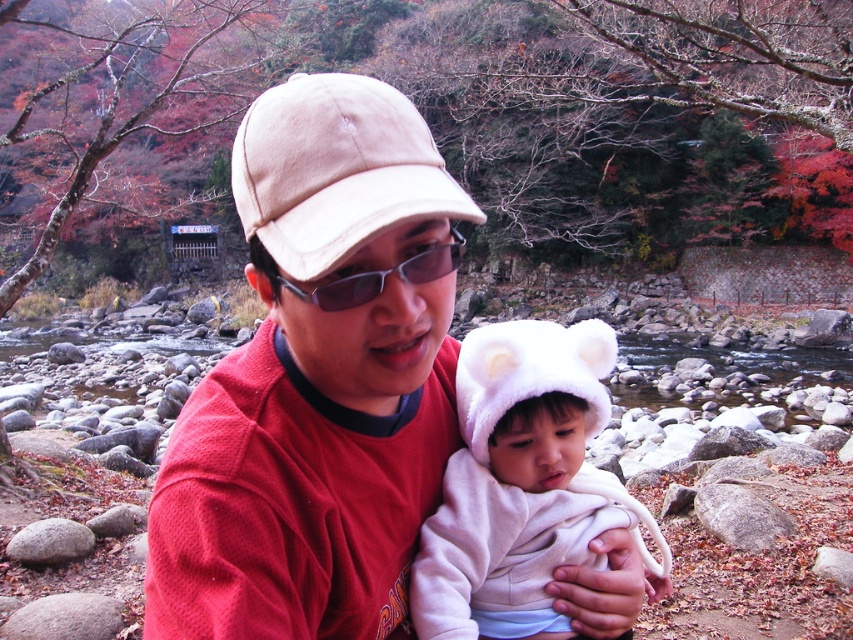
Which is more to the right, white fleece hat at center or sunglasses at center?

white fleece hat at center

Is white fleece hat at center shorter than sunglasses at center?

In fact, white fleece hat at center may be taller than sunglasses at center.

At what (x,y) coordinates should I click in order to perform the action: click on white fleece hat at center. Please return your answer as a coordinate pair (x, y). Looking at the image, I should click on (520, 486).

Is white fluffy hat at center positioned before sunglasses at center?

That is False.

Is point (590, 387) in front of point (426, 250)?

No, it is not.

Where is `white fluffy hat at center`? white fluffy hat at center is located at coordinates (531, 372).

Consider the image. Which is more to the right, matte red shirt at center or white fleece hat at center?

Positioned to the right is white fleece hat at center.

Consider the image. Between matte red shirt at center and white fleece hat at center, which one appears on the left side from the viewer's perspective?

matte red shirt at center is more to the left.

Find the location of a particular element. matte red shirt at center is located at coordinates 318,380.

You are a GUI agent. You are given a task and a screenshot of the screen. Output one action in this format:
    pyautogui.click(x=<x>, y=<y>)
    Task: Click on the matte red shirt at center
    The image size is (853, 640).
    Given the screenshot: What is the action you would take?
    pyautogui.click(x=318, y=380)